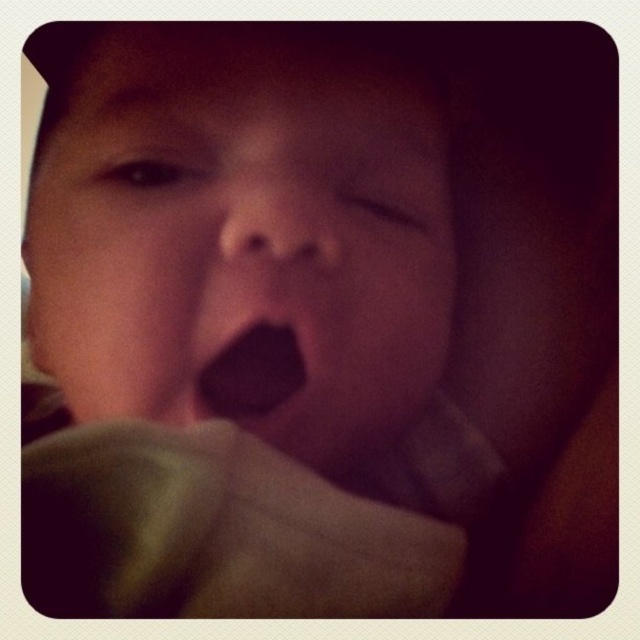
Based on the scene description, which object is taller between the smooth skin face at center and the black matte tongue at center?

The smooth skin face at center is much taller than the black matte tongue at center.

Based on the scene description, can you determine if the smooth skin face at center is wider than the black matte tongue at center?

The smooth skin face at center might be wider than black matte tongue at center according to the objects description.

You are a photographer trying to capture a closeup of a person yawning. You notice the smooth skin face at center and the black matte tongue at center in your viewfinder. Which object is positioned to the left in the image?

The smooth skin face at center is positioned to the left of the black matte tongue at center.